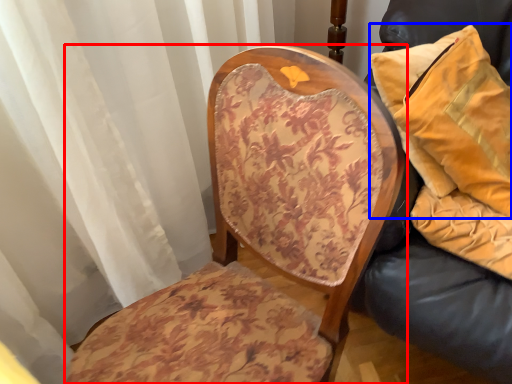
Question: Which of the following is the closest to the observer, chair (highlighted by a red box) or pillow (highlighted by a blue box)?

Choices:
 (A) chair
 (B) pillow

Answer: (A)